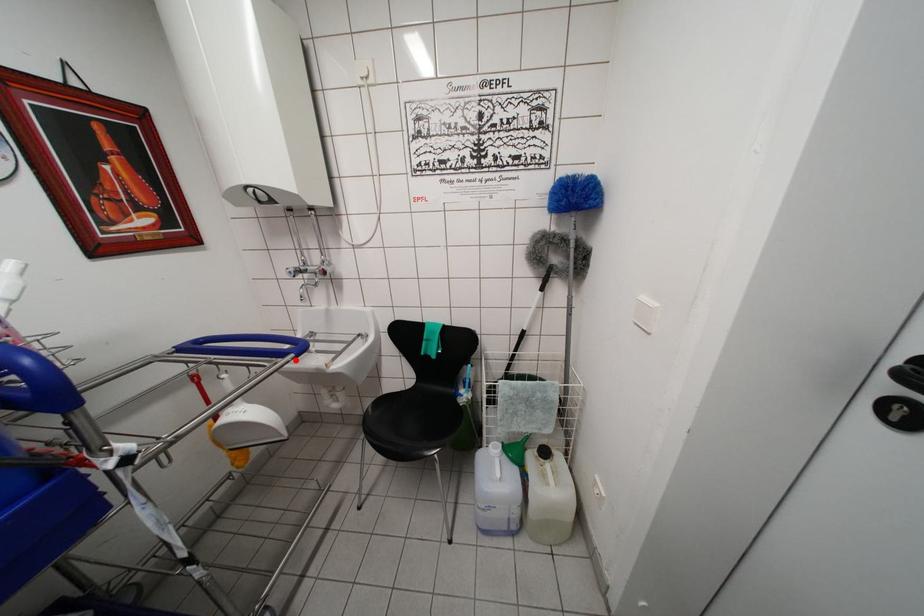
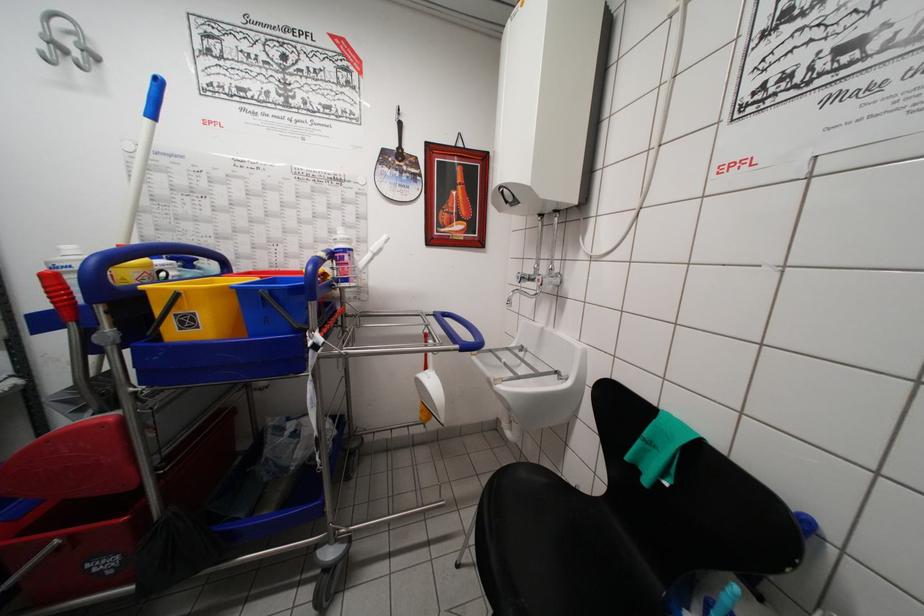
Where in the second image is the point corresponding to the highlighted location from the first image?

(460, 351)